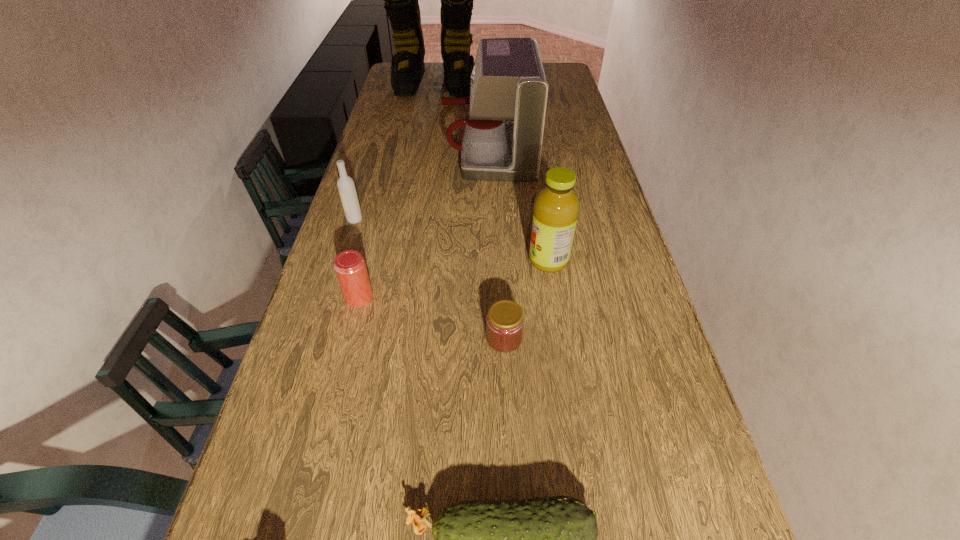
Identify the location of vacant space located on the front of the second nearest object. (508, 421).

This screenshot has width=960, height=540. What are the coordinates of `object at the far edge` in the screenshot? It's located at (401, 0).

The image size is (960, 540). I want to click on ski boots that is positioned at the left edge, so pos(401,0).

Find the location of `vodka positioned at the left edge`. vodka positioned at the left edge is located at coordinates (345, 184).

At what (x,y) coordinates should I click in order to perform the action: click on beer can at the left edge. Please return your answer as a coordinate pair (x, y). The image size is (960, 540). Looking at the image, I should click on (350, 267).

Locate an element on the screen. This screenshot has width=960, height=540. object situated at the far left corner is located at coordinates (401, 0).

This screenshot has height=540, width=960. Identify the location of free space at the far edge of the desktop. (431, 77).

Find the location of `free space at the left edge of the desktop`. free space at the left edge of the desktop is located at coordinates (419, 107).

The height and width of the screenshot is (540, 960). I want to click on free space at the right edge of the desktop, so click(x=596, y=338).

Where is `vacant region between the ski boots and the jam`? vacant region between the ski boots and the jam is located at coordinates (468, 211).